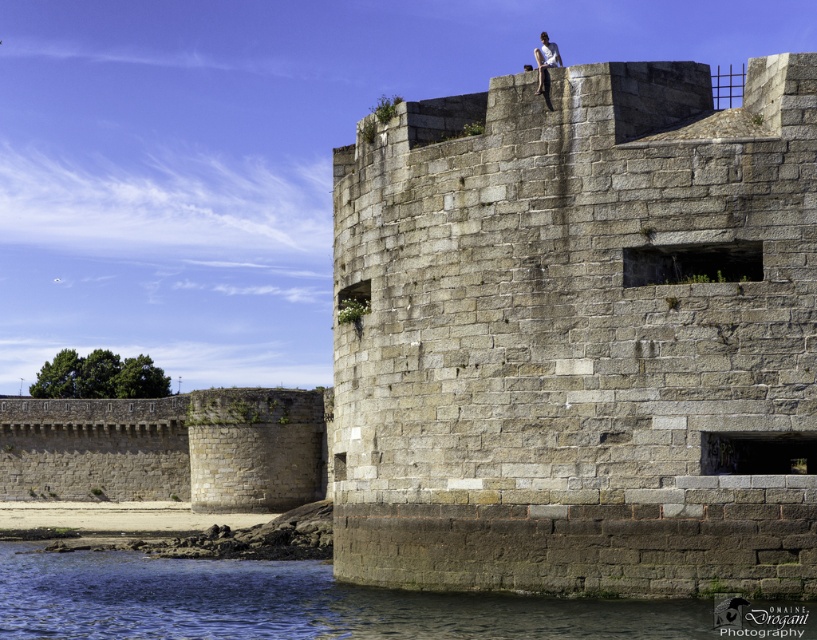
You are standing at the edge of the sandy beach in the foreground of the fortress. You need to reach the gray stone wall at upper center. Which direction should you move to get closer to it?

→ The gray stone wall at upper center is located at point (581,337), so you should move towards the upper center direction to reach it.

You are an artist sketching the historic fortress. You notice two elements at the upper center of your drawing. Which one is smaller in size between the gray stone wall at upper center and the white fabric shirt at upper center?

The gray stone wall at upper center is smaller in size compared to the white fabric shirt at upper center according to the description.

You are standing at the edge of the fortress and want to take a photo of the gray stone wall at upper center. According to the coordinates provided, where exactly should you position your camera to capture it?

The gray stone wall at upper center is located at coordinates point (581,337), so position your camera there to capture it.